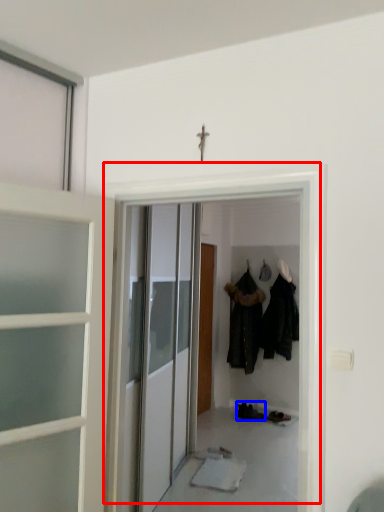
Question: Which of the following is the farthest to the observer, door (highlighted by a red box) or footwear (highlighted by a blue box)?

Choices:
 (A) door
 (B) footwear

Answer: (B)